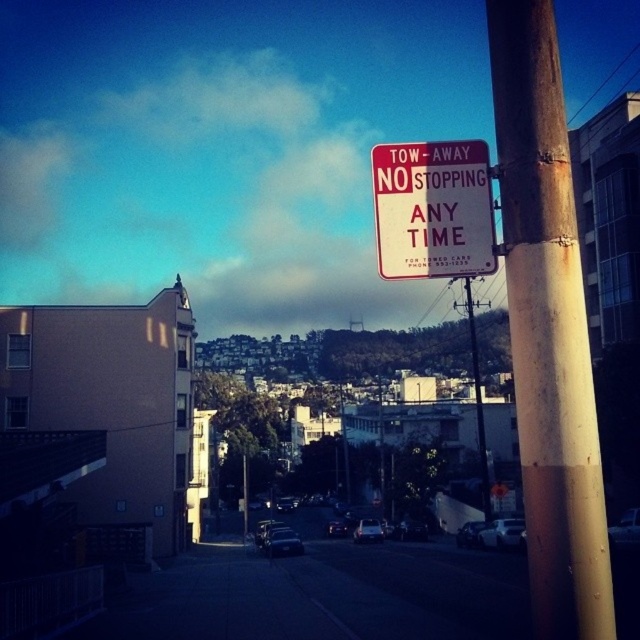
Question: Does rusty metal pole at right have a lesser width compared to red plastic sign at upper right?

Choices:
 (A) no
 (B) yes

Answer: (A)

Question: Does rusty metal pole at right appear on the right side of red plastic sign at upper right?

Choices:
 (A) yes
 (B) no

Answer: (A)

Question: Which object is farther from the camera taking this photo?

Choices:
 (A) red plastic sign at upper right
 (B) rusty metal pole at right

Answer: (A)

Question: Which of the following is the closest to the observer?

Choices:
 (A) red plastic sign at upper right
 (B) rusty metal pole at right

Answer: (B)

Question: Which point is closer to the camera taking this photo?

Choices:
 (A) (474, 211)
 (B) (509, 150)

Answer: (B)

Question: Where is rusty metal pole at right located in relation to red plastic sign at upper right in the image?

Choices:
 (A) left
 (B) right

Answer: (B)